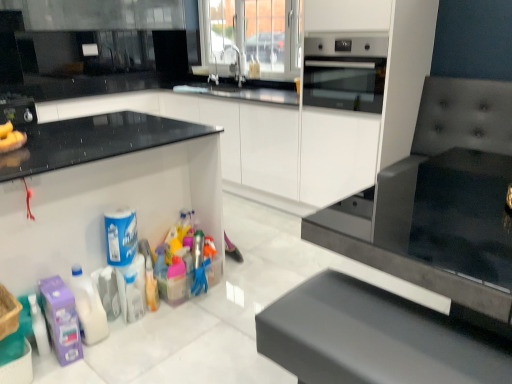
Image resolution: width=512 pixels, height=384 pixels. Find the location of `vacant space underneath silver metallic faucet at upper center, marked as the first faucet in a right-to-left arrangement (from a real-world perspective)`. vacant space underneath silver metallic faucet at upper center, marked as the first faucet in a right-to-left arrangement (from a real-world perspective) is located at coordinates (234, 84).